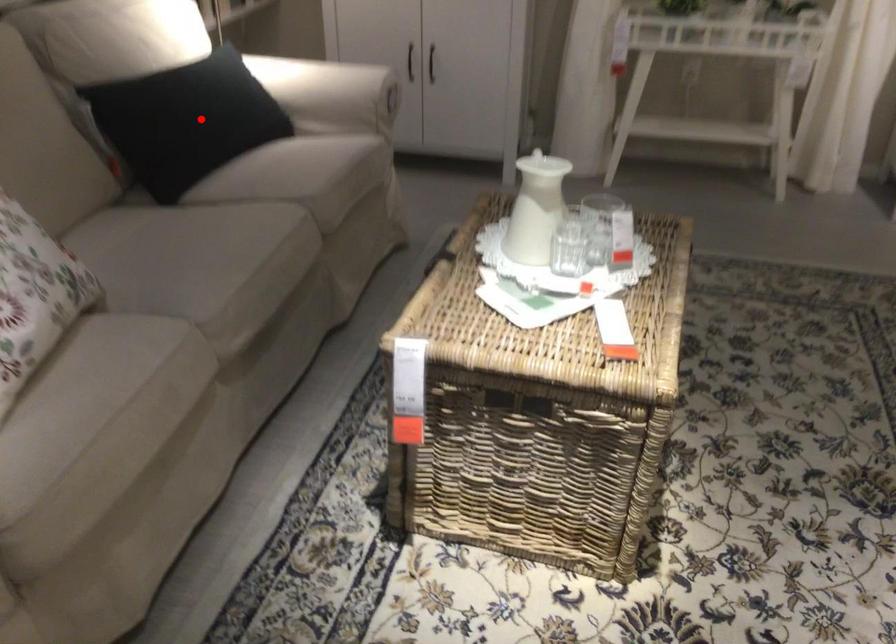
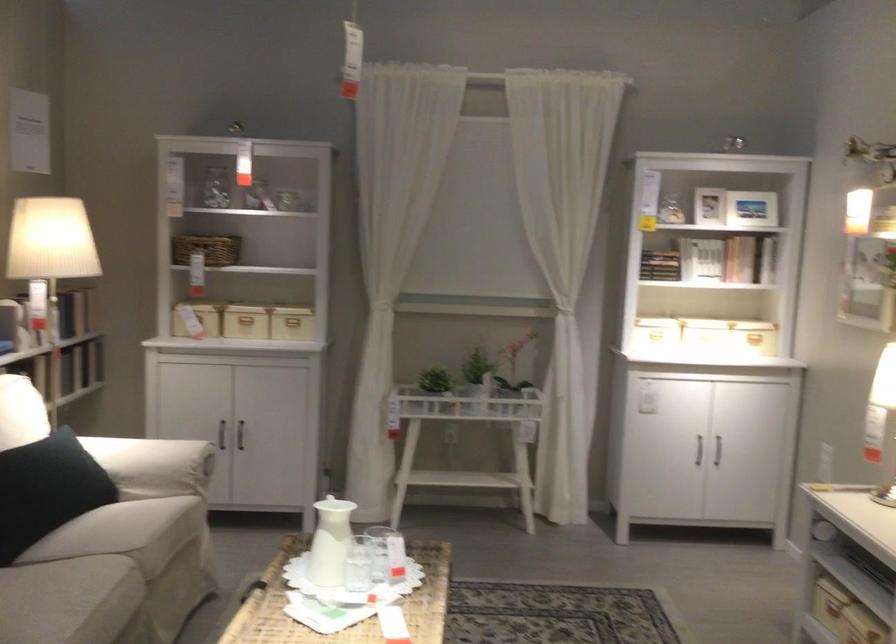
Locate, in the second image, the point that corresponds to the highlighted location in the first image.

(47, 489)